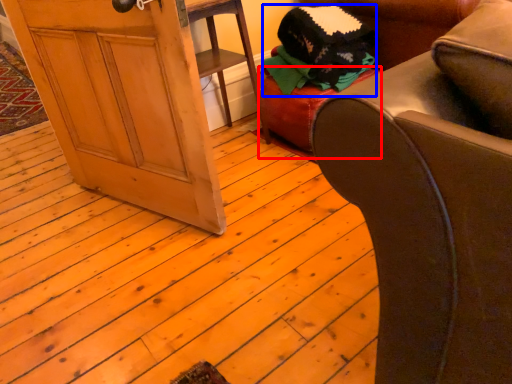
Question: Which object is further to the camera taking this photo, stool (highlighted by a red box) or clothing (highlighted by a blue box)?

Choices:
 (A) stool
 (B) clothing

Answer: (A)